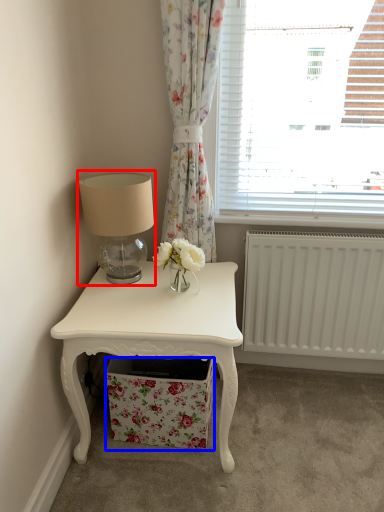
Question: Which of the following is the farthest to the observer, table lamp (highlighted by a red box) or drawer (highlighted by a blue box)?

Choices:
 (A) table lamp
 (B) drawer

Answer: (B)